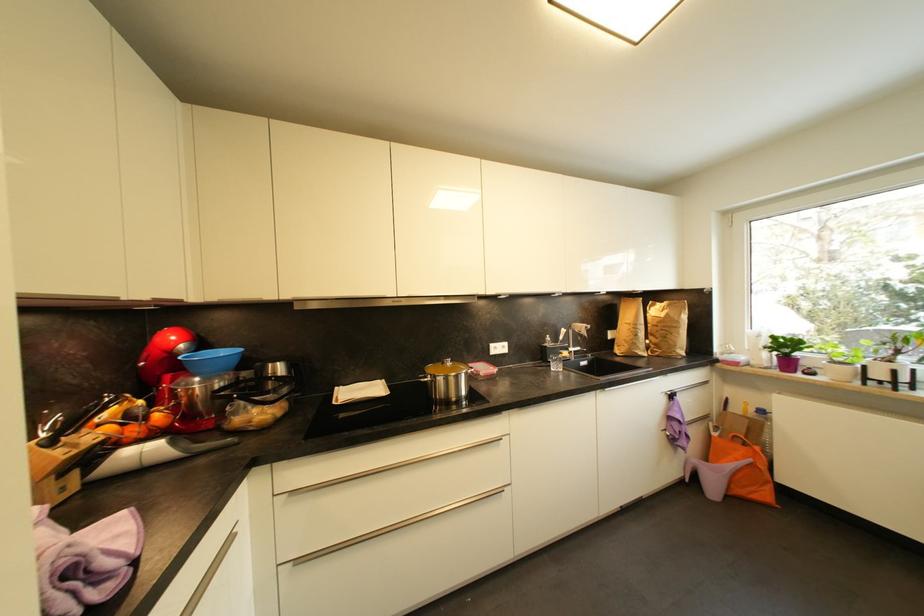
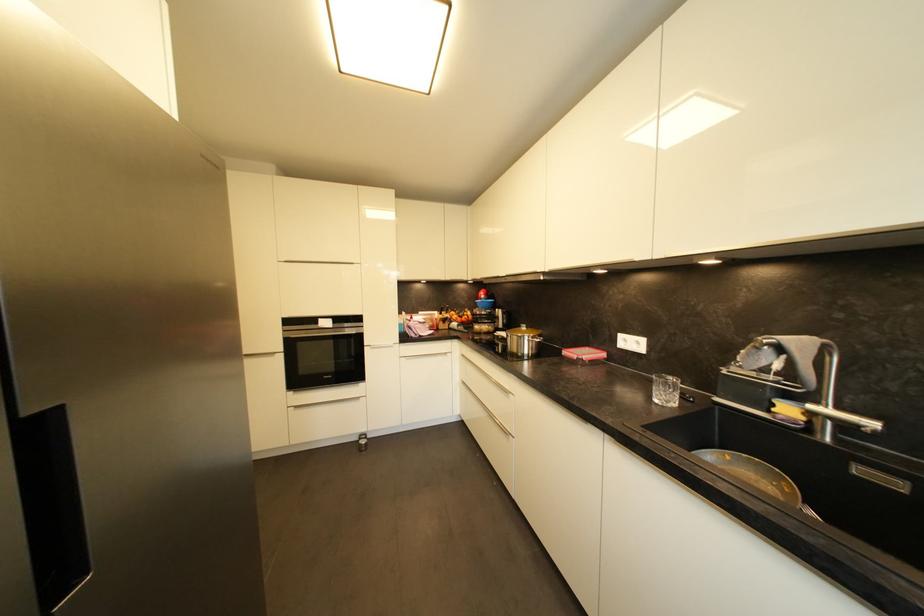
Locate, in the second image, the point that corresponds to point (569, 355) in the first image.

(793, 411)